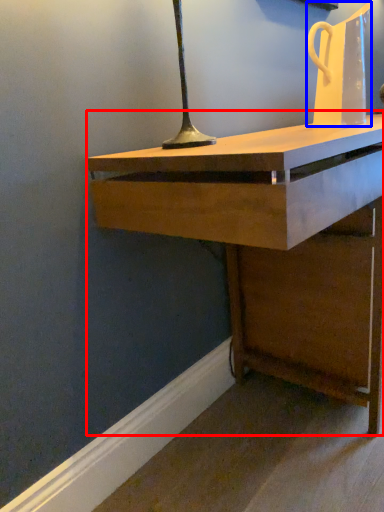
Question: Among these objects, which one is nearest to the camera, desk (highlighted by a red box) or jug (highlighted by a blue box)?

Choices:
 (A) desk
 (B) jug

Answer: (A)